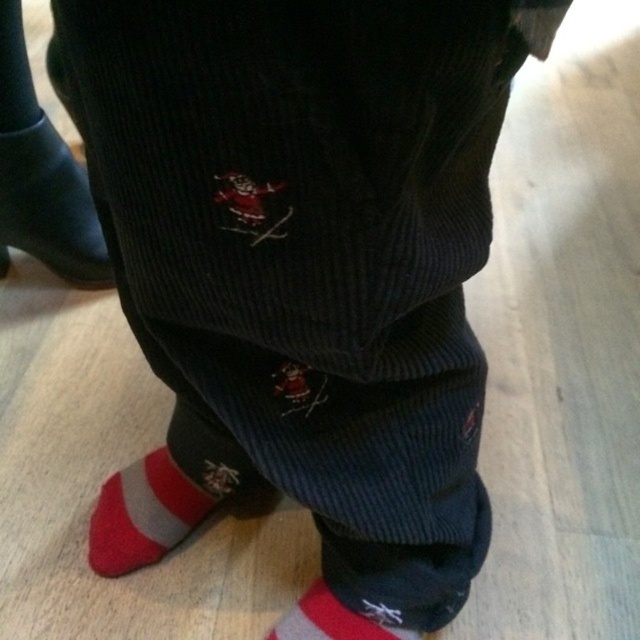
Based on the photo, you are a delivery robot that is 24 inches wide. You need to move from the entrance to the kitchen, which is located behind the person shown in the image. The path to the kitchen requires passing through a narrow space near the point at coordinates point [156,534]. What is the minimum width of the path at that point to ensure you can pass through safely?

The distance of point [156,534] from viewer is 36.29 inches. Since the robot is 24 inches wide, the minimum width required is at least 24 inches. Therefore, the path at point [156,534] is wide enough for the robot to pass through safely as long as the width is maintained at 24 inches or more.

You are a tailor measuring the distance between the matte black pants at center and the red cotton sock at lower left. The minimum required distance for proper alteration is 24 inches. Is the current distance sufficient?

The distance between the matte black pants at center and the red cotton sock at lower left is 23.29 inches, which is less than the required 24 inches. Therefore, the current distance is insufficient for proper alteration.